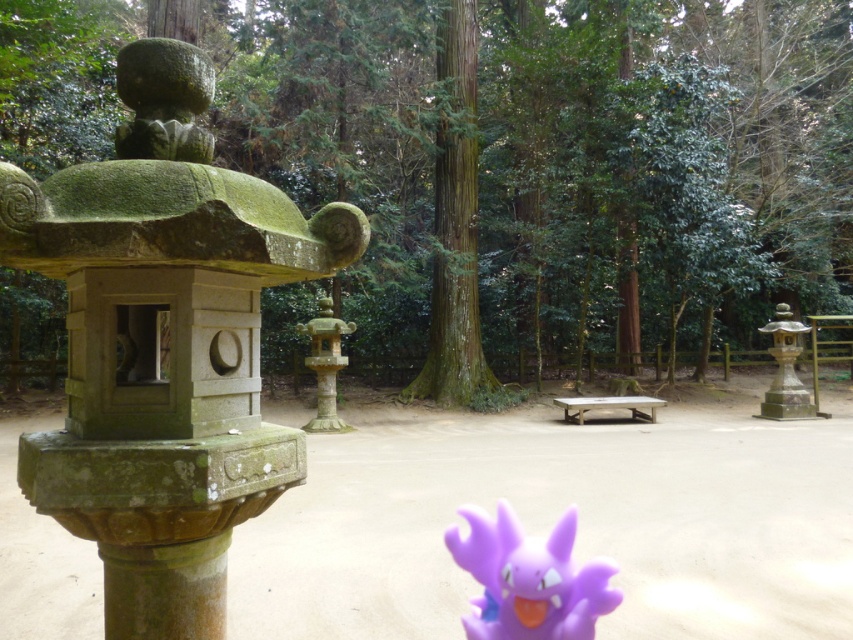
Question: Which point is closer to the camera?

Choices:
 (A) (334, 214)
 (B) (579, 592)

Answer: (B)

Question: Is green mossy stone statue at upper left positioned in front of smooth stone lantern at center?

Choices:
 (A) no
 (B) yes

Answer: (B)

Question: Does green mossy stone lantern at left have a greater width compared to green mossy stone statue at upper left?

Choices:
 (A) no
 (B) yes

Answer: (B)

Question: Can you confirm if purple plastic toy at center is positioned below smooth stone lantern at center?

Choices:
 (A) no
 (B) yes

Answer: (A)

Question: Which of the following is the farthest from the observer?

Choices:
 (A) (100, 364)
 (B) (183, 147)
 (C) (531, 625)
 (D) (321, 300)

Answer: (D)

Question: Among these objects, which one is farthest from the camera?

Choices:
 (A) smooth stone lantern at center
 (B) green mossy stone lantern at left
 (C) green mossy stone statue at upper left
 (D) purple plastic toy at center

Answer: (A)